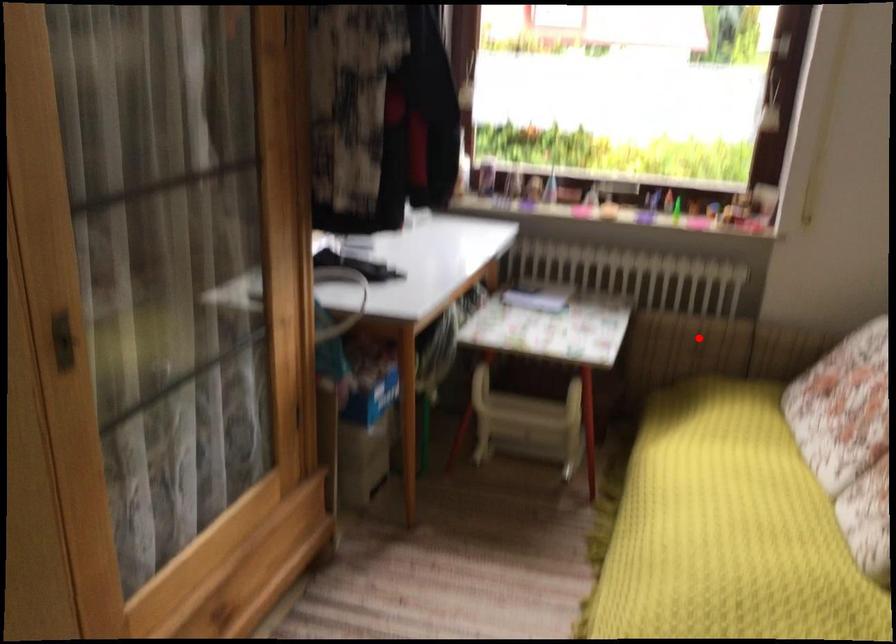
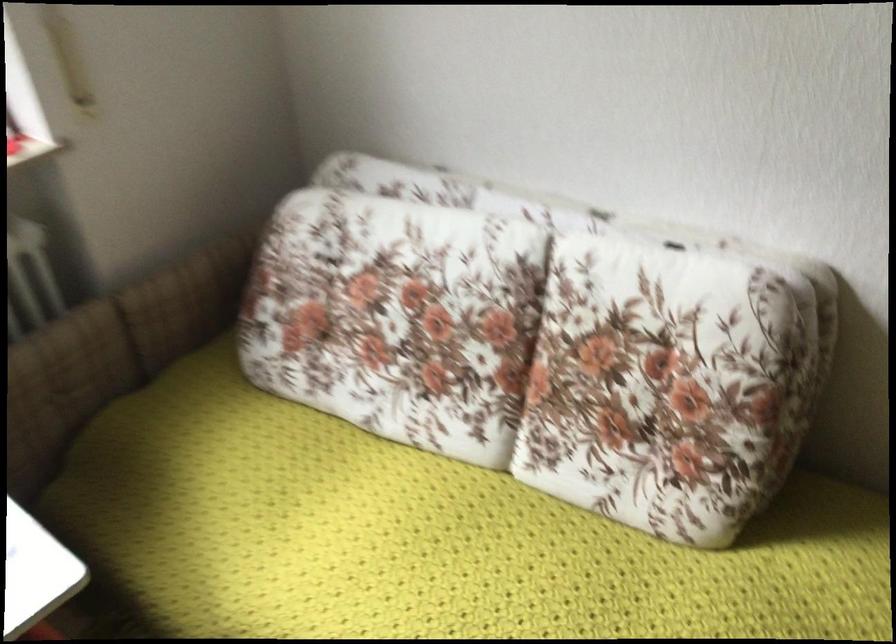
Question: I am providing you with two images of the same scene from different viewpoints. Image1 has a red point marked. In image2, the corresponding 3D location appears at what relative position? Reply with the corresponding letter.

Choices:
 (A) Closer
 (B) Farther

Answer: (A)